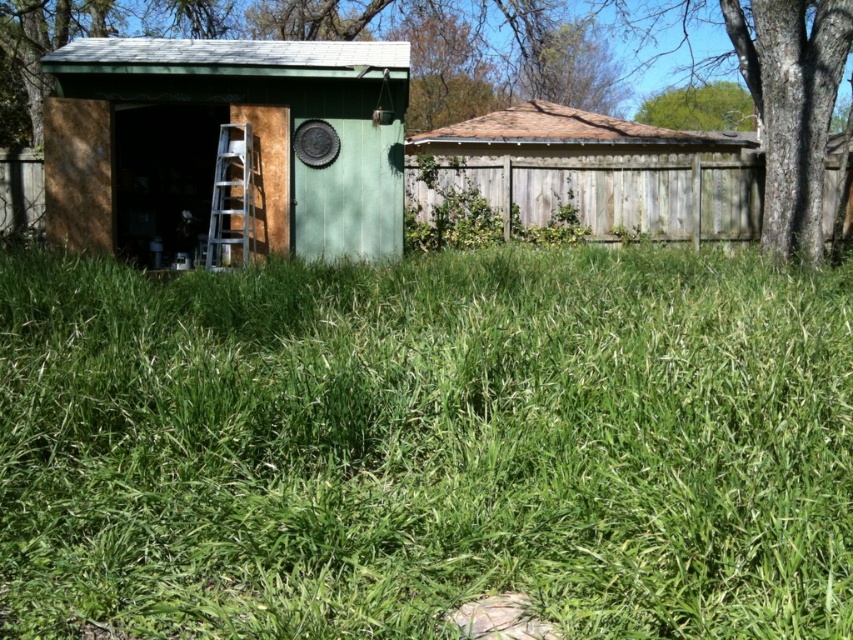
You are standing in the backyard and want to place a new garden bench between the green wood tree at upper center and the silver metallic ladder at center. The bench requires 3 meters of space. Do you think there is enough space between them to fit the bench?

The distance between the green wood tree at upper center and the silver metallic ladder at center is 9.28 meters, which is more than enough to accommodate the 3 meter requirement for the bench.